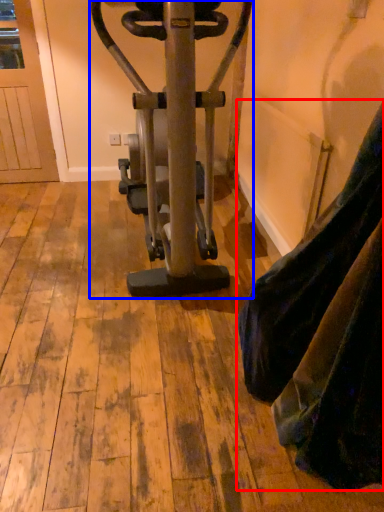
Question: Which of the following is the farthest to the observer, tight (highlighted by a red box) or stationary bicycle (highlighted by a blue box)?

Choices:
 (A) tight
 (B) stationary bicycle

Answer: (B)